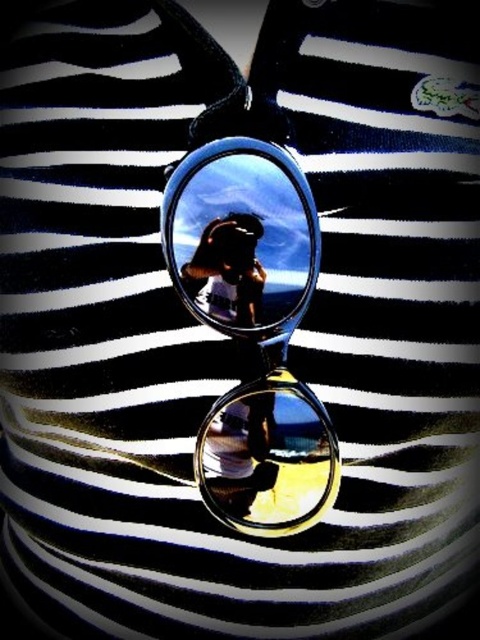
You are trying to place a sticker exactly at the center of the image. The clear plastic goggles at center are located at point 0.372, 0.504. Is the sticker placement at the center of the image possible without overlapping the goggles?

The clear plastic goggles at center are located at point (241, 237), which is not the exact center of the image. The center of an image is typically at coordinates (240, 320). Therefore, placing the sticker at the exact center of the image would not overlap with the clear plastic goggles at center.

You are holding a camera and want to take a photo of the sunglasses. The camera is 13.41 inches away from the point at coordinates (230, 230). Is the camera positioned close enough to capture the entire sunglasses in the frame?

The point at coordinates (230, 230) is 13.41 inches from the camera. Since this point is part of the sunglasses, the camera is positioned at the correct distance to capture the entire sunglasses in the frame.

You are holding a metallic silver phone at center and want to take a photo of the clear glass lens at center. Since the phone is 3.24 inches away from the lens, will you be able to capture the entire lens in the photo without zooming?

The clear glass lens at center and metallic silver phone at center are 3.24 inches apart. To capture the entire lens without zooming, ensure the phone is positioned at a distance where the lens fits within the camera frame. However, the exact ability depends on the phone camera sensor and lens specifications, which aren generated in the scene description. Assuming standard smartphone capabilities, 3.24 inches might be close enough for a full capture if framed correctly.